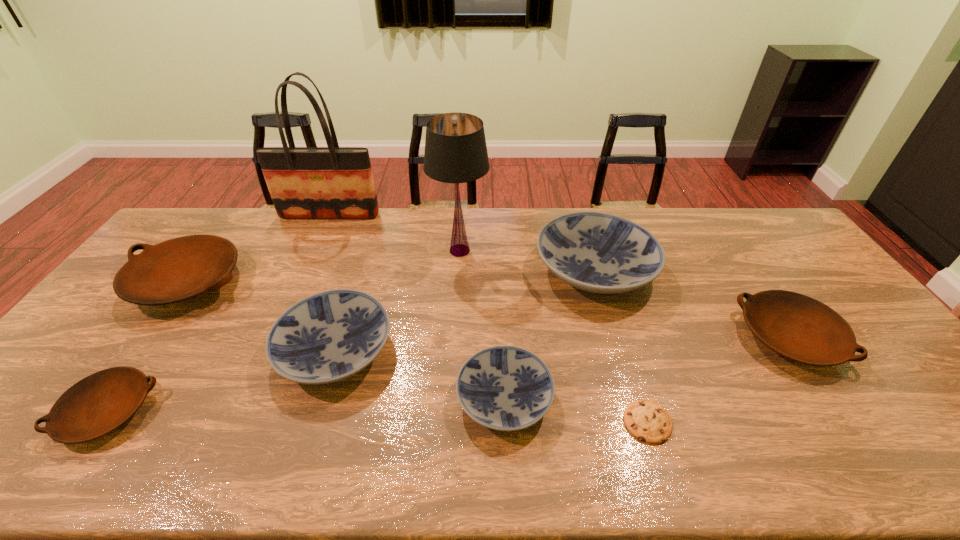
Image resolution: width=960 pixels, height=540 pixels. I want to click on the farthest object, so click(332, 182).

At what (x,y) coordinates should I click in order to perform the action: click on lampshade. Please return your answer as a coordinate pair (x, y). The image size is (960, 540). Looking at the image, I should click on (455, 151).

Locate an element on the screen. Image resolution: width=960 pixels, height=540 pixels. the biggest blue plate is located at coordinates (596, 252).

Image resolution: width=960 pixels, height=540 pixels. In order to click on the tallest plate in this screenshot , I will do `click(596, 252)`.

Where is `the biggest brown plate`? The height and width of the screenshot is (540, 960). the biggest brown plate is located at coordinates (178, 269).

Find the location of a particular element. the leftmost blue plate is located at coordinates (327, 337).

The width and height of the screenshot is (960, 540). I want to click on the fourth plate from right to left, so (327, 337).

The width and height of the screenshot is (960, 540). Find the location of `the rightmost brown plate`. the rightmost brown plate is located at coordinates (800, 328).

Locate an element on the screen. This screenshot has width=960, height=540. the rightmost object is located at coordinates (800, 328).

What are the coordinates of `the fourth plate from left to right` in the screenshot? It's located at (506, 388).